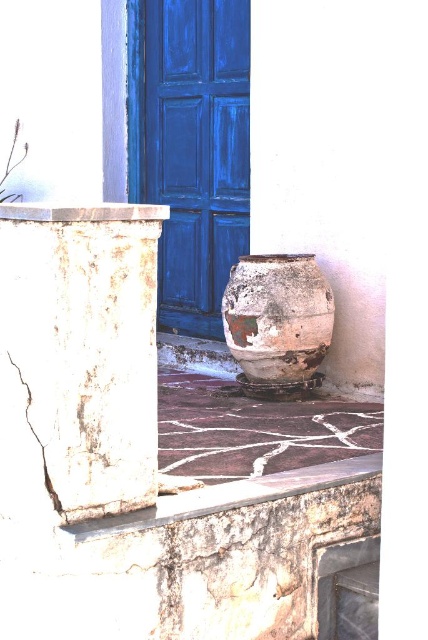
You are a delivery person trying to place a new package on the surface between the rusty ceramic vase at center and the rusty stone ledge at lower center. Which object is narrower so you can place the package there?

The rusty ceramic vase at center is thinner than the rusty stone ledge at lower center, so you can place the package on the narrower rusty ceramic vase at center.

You are standing at the point marked as point (x=17, y=365) and want to reach the weathered stone column on the left side of the frame. Can you walk directly to it without any obstacles?

The distance between you at point (x=17, y=365) and the weathered stone column on the left side of the frame is 3.05 meters. Since there are no mentioned obstacles in the scene, you can walk directly to it.

You are standing in front of a white wall with two objects. You see a white cracked stone column at left and a rusty ceramic vase at center. Which object is closer to the left edge of the wall?

The white cracked stone column at left is closer to the left edge of the wall because it is positioned to the left of the rusty ceramic vase at center.